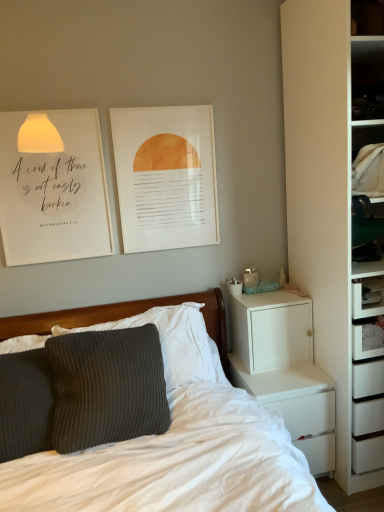
Question: From a real-world perspective, is matte paper picture frame at upper center under white matte chest of drawers at right?

Choices:
 (A) yes
 (B) no

Answer: (B)

Question: Does matte paper picture frame at upper center have a lesser height compared to white matte chest of drawers at right?

Choices:
 (A) yes
 (B) no

Answer: (B)

Question: Does matte paper picture frame at upper center have a greater height compared to white matte chest of drawers at right?

Choices:
 (A) no
 (B) yes

Answer: (B)

Question: Does matte paper picture frame at upper center have a smaller size compared to white matte chest of drawers at right?

Choices:
 (A) yes
 (B) no

Answer: (A)

Question: Considering the relative sizes of matte paper picture frame at upper center and white matte chest of drawers at right in the image provided, is matte paper picture frame at upper center wider than white matte chest of drawers at right?

Choices:
 (A) yes
 (B) no

Answer: (B)

Question: From the image's perspective, does matte paper picture frame at upper center appear higher than white matte chest of drawers at right?

Choices:
 (A) no
 (B) yes

Answer: (B)

Question: Is white matte cabinet at right further to camera compared to white paper at upper left?

Choices:
 (A) no
 (B) yes

Answer: (B)

Question: Does white matte cabinet at right have a larger size compared to white paper at upper left?

Choices:
 (A) yes
 (B) no

Answer: (A)

Question: Is white matte cabinet at right in contact with white paper at upper left?

Choices:
 (A) yes
 (B) no

Answer: (B)

Question: From the image's perspective, is white matte cabinet at right on white paper at upper left?

Choices:
 (A) no
 (B) yes

Answer: (A)

Question: Could you tell me if white matte cabinet at right is facing white paper at upper left?

Choices:
 (A) no
 (B) yes

Answer: (A)

Question: From the image's perspective, is white matte cabinet at right below white paper at upper left?

Choices:
 (A) yes
 (B) no

Answer: (A)

Question: Is white paper at upper left outside white matte chest of drawers at right?

Choices:
 (A) no
 (B) yes

Answer: (B)